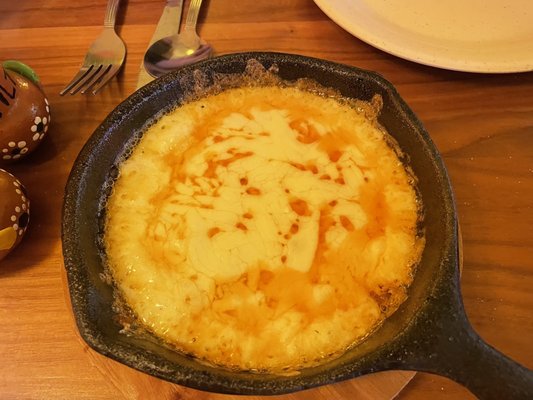
Locate an element on the screen. This screenshot has width=533, height=400. salt and pepper shakers is located at coordinates (21, 121), (8, 200).